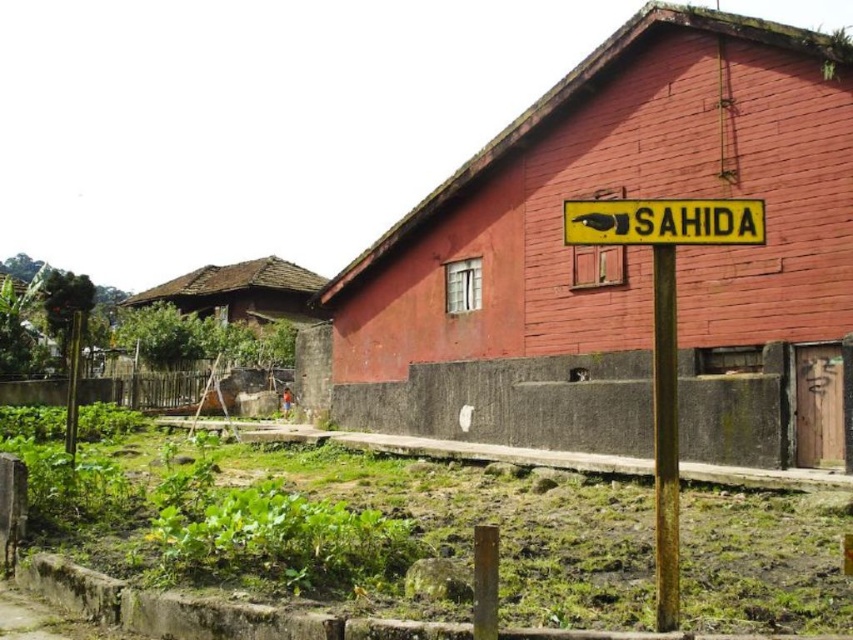
Question: Which point appears farthest from the camera in this image?

Choices:
 (A) (653, 275)
 (B) (840, 292)
 (C) (610, 221)

Answer: (A)

Question: Which point is closer to the camera taking this photo?

Choices:
 (A) (659, 273)
 (B) (666, 602)
 (C) (399, 355)

Answer: (B)

Question: Is smooth red wooden hut at center further to camera compared to yellow plastic sign at upper center?

Choices:
 (A) yes
 (B) no

Answer: (A)

Question: Does smooth red wooden hut at center appear over yellow plastic sign at upper center?

Choices:
 (A) yes
 (B) no

Answer: (B)

Question: Does smooth red wooden hut at center appear under yellow plastic sign at upper center?

Choices:
 (A) no
 (B) yes

Answer: (B)

Question: Considering the real-world distances, which object is farthest from the yellow metal sign at center?

Choices:
 (A) yellow plastic sign at upper center
 (B) rusty metal pole at right
 (C) smooth red wooden hut at center

Answer: (C)